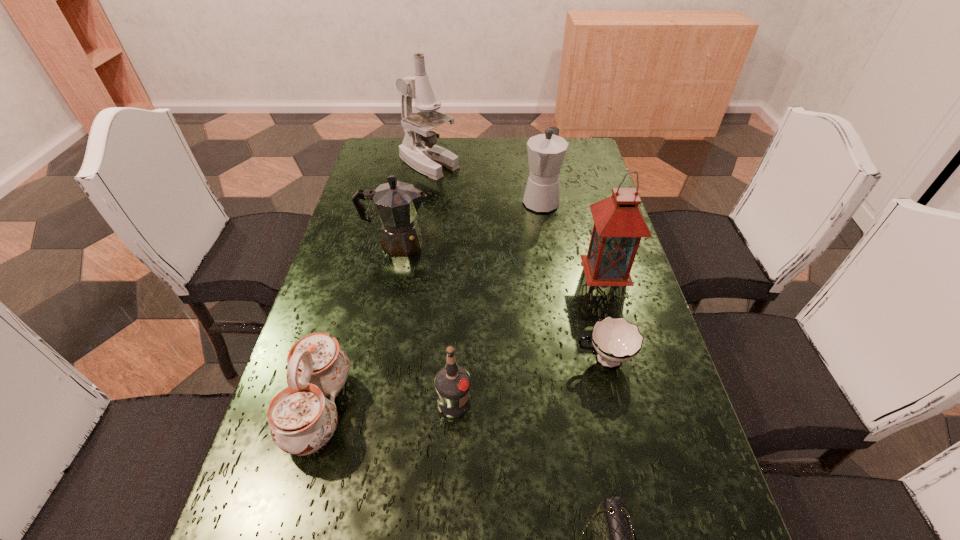
Where is `free point between the chinaware and the vodka`? free point between the chinaware and the vodka is located at coordinates (387, 406).

Where is `free space between the seventh shortest object and the nearer coffeepot`? This screenshot has height=540, width=960. free space between the seventh shortest object and the nearer coffeepot is located at coordinates (502, 257).

Locate an element on the screen. vacant region between the chinaware and the seventh shortest object is located at coordinates (463, 340).

Locate an element on the screen. The width and height of the screenshot is (960, 540). vacant region between the nearer coffeepot and the vodka is located at coordinates (426, 323).

Identify the location of vacant area between the right coffeepot and the nearer coffeepot. Image resolution: width=960 pixels, height=540 pixels. (469, 222).

At what (x,y) coordinates should I click in order to perform the action: click on free spot between the seventh shortest object and the seventh nearest object. Please return your answer as a coordinate pair (x, y). This screenshot has width=960, height=540. Looking at the image, I should click on (573, 235).

Where is `empty location between the nearer coffeepot and the cup`? This screenshot has height=540, width=960. empty location between the nearer coffeepot and the cup is located at coordinates (500, 301).

Identify which object is the sixth nearest to the tallest object. Please provide its 2D coordinates. Your answer should be formatted as a tuple, i.e. [(x, y)], where the tuple contains the x and y coordinates of a point satisfying the conditions above.

[(452, 383)]

This screenshot has height=540, width=960. What are the coordinates of `the closest object relative to the seventh shortest object` in the screenshot? It's located at (546, 152).

What are the coordinates of `free location that satisfies the following two spatial constraints: 1. on the pouring side of the left coffeepot; 2. on the left side of the lantern` in the screenshot? It's located at (392, 270).